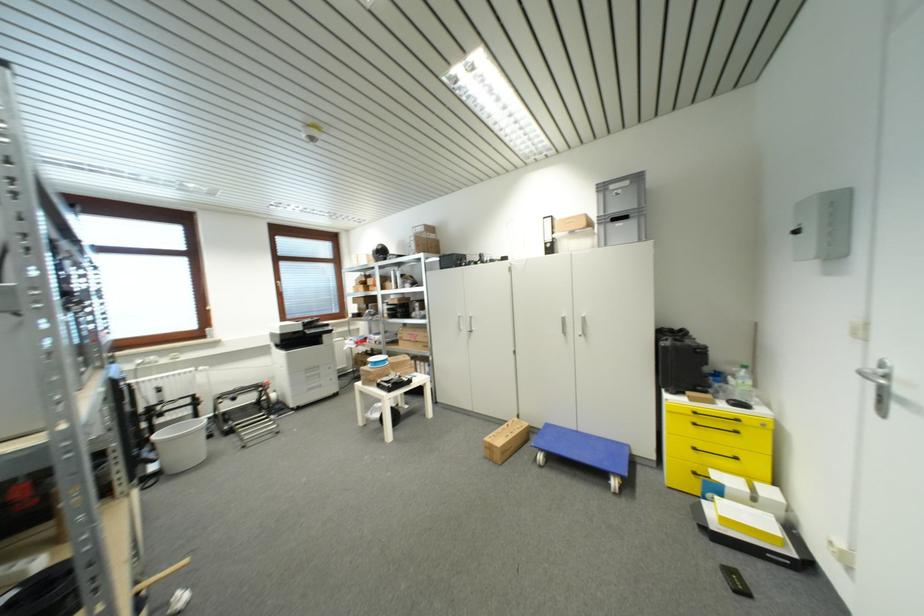
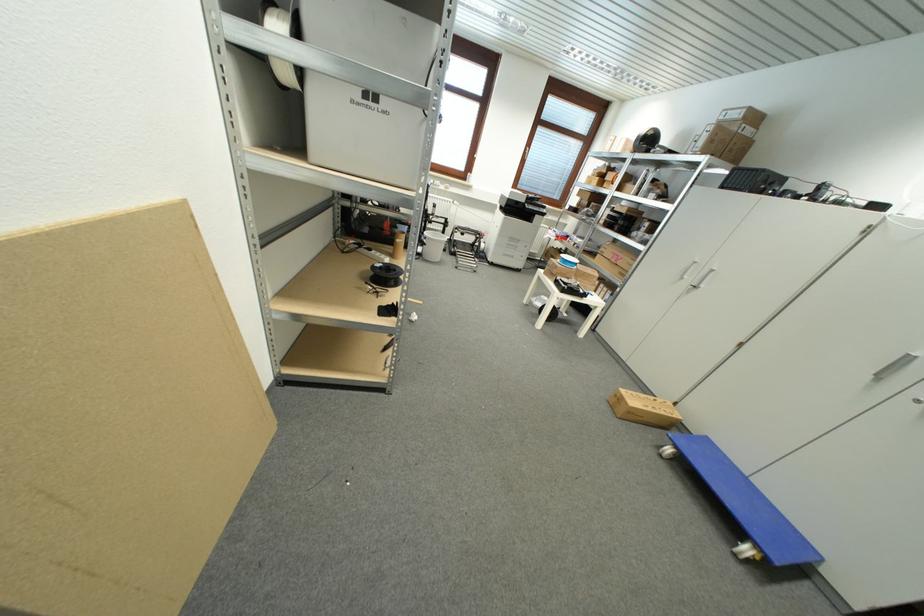
The point at (423, 381) is marked in the first image. Where is the corresponding point in the second image?

(599, 301)